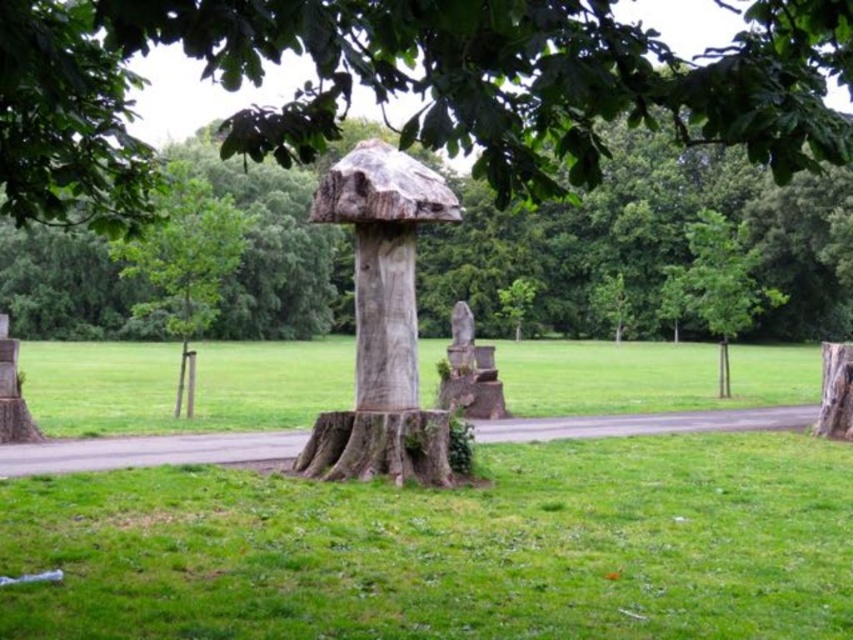
Between point (61, 545) and point (271, 19), which one is positioned behind?

The point (61, 545) is behind.

Between green grass at center and smooth wooden stump at center, which one appears on the left side from the viewer's perspective?

smooth wooden stump at center is more to the left.

The image size is (853, 640). What do you see at coordinates (450, 547) in the screenshot?
I see `green grass at center` at bounding box center [450, 547].

I want to click on green grass at center, so click(450, 547).

Does green wood tree at center appear under smooth brown tree stump at center?

No.

Who is positioned more to the left, green wood tree at center or smooth brown tree stump at center?

green wood tree at center

Locate an element on the screen. green wood tree at center is located at coordinates (184, 260).

Find the location of a particular element. green wood tree at center is located at coordinates (184, 260).

Does wooden sculpture at center have a smaller size compared to smooth stone statue at center?

No, wooden sculpture at center is not smaller than smooth stone statue at center.

Between point (358, 353) and point (469, 416), which one is positioned in front?

Positioned in front is point (358, 353).

Find the location of a particular element. wooden sculpture at center is located at coordinates (381, 321).